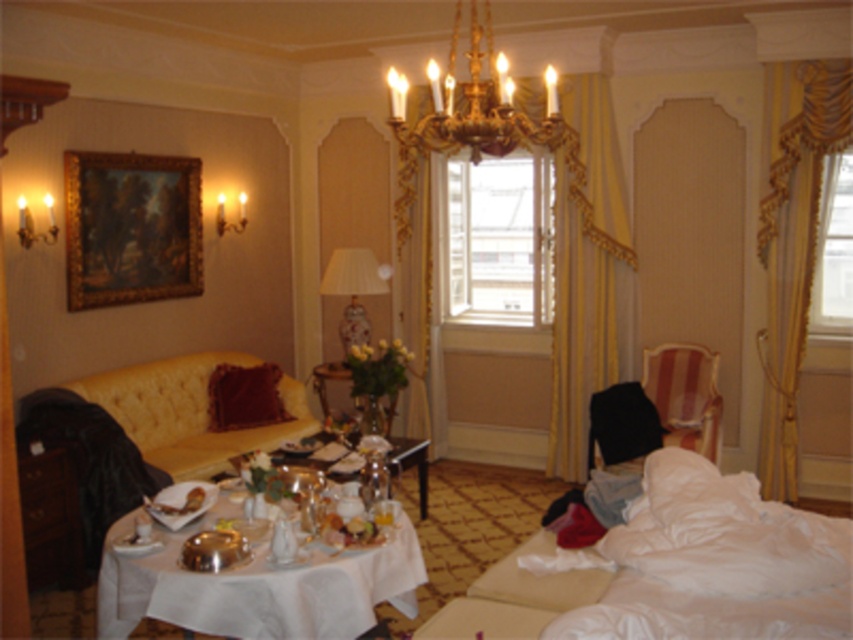
You are planning to place a small candle on the satin silver plate at lower left. The velvet red pillow at center is nearby. Will the candle fit on the plate without spilling over?

The velvet red pillow at center is larger than the satin silver plate at lower left, so the candle might not fit properly on the plate since the plate is smaller in size.